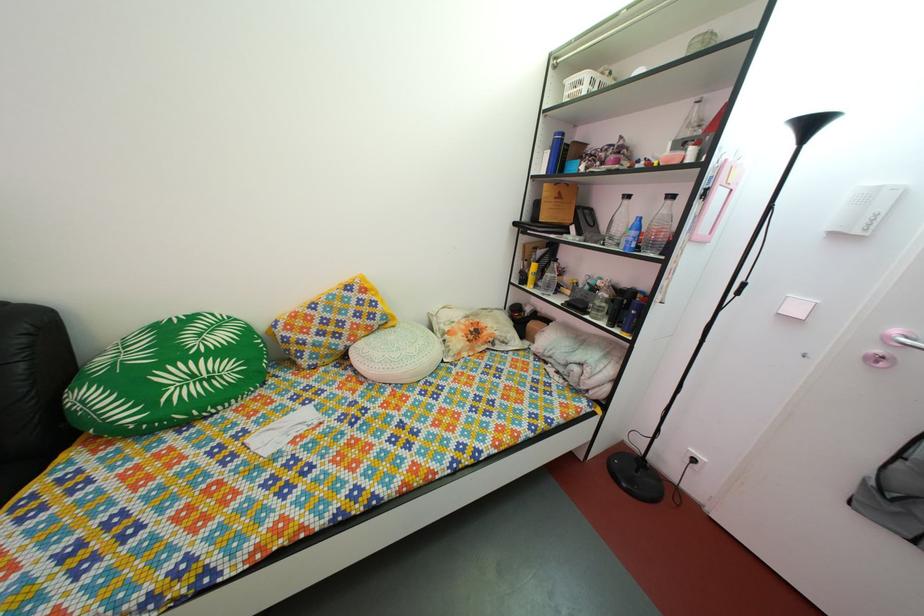
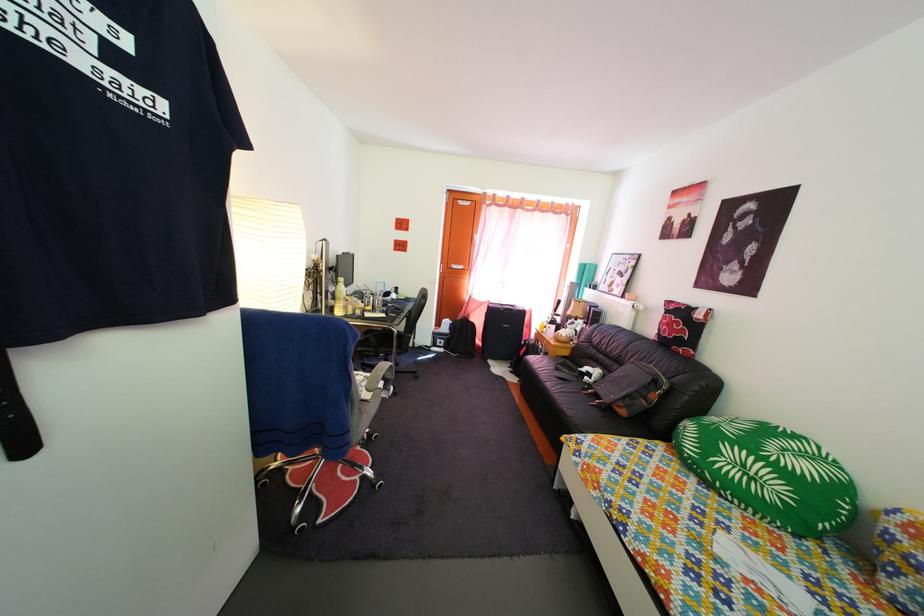
Looking at this image, the first image is from the beginning of the video and the second image is from the end. How did the camera likely rotate when shooting the video?

The camera's rotation is toward left-down.